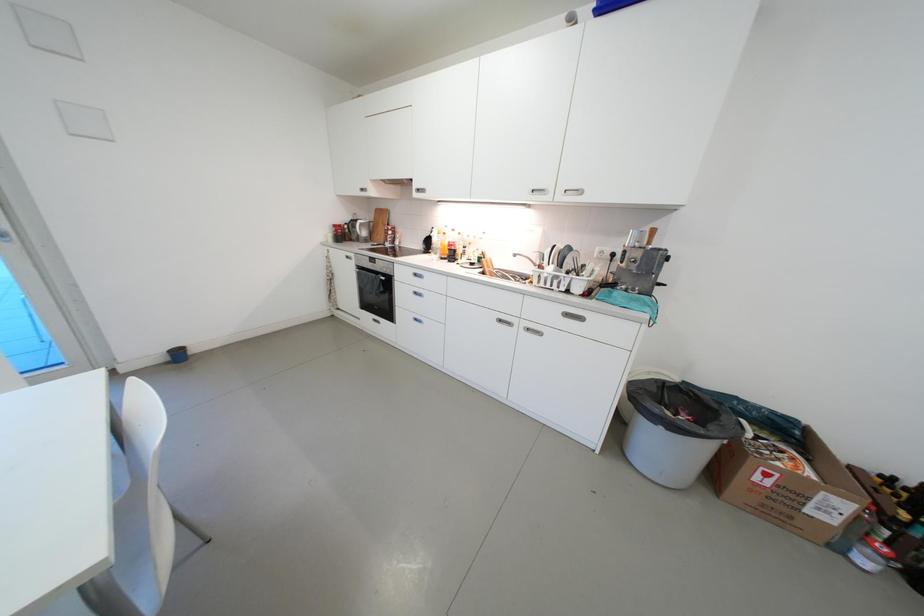
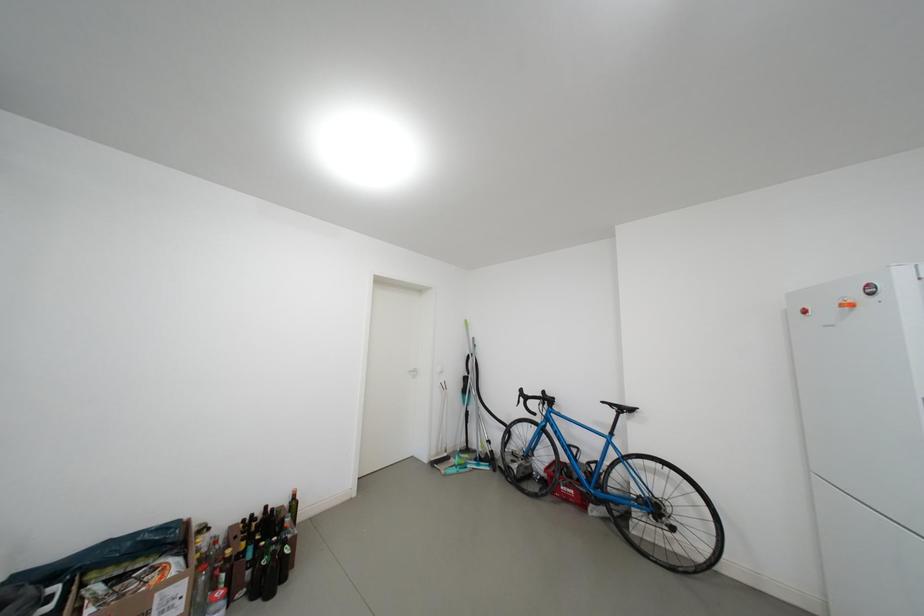
Question: The camera is either moving clockwise (left) or counter-clockwise (right) around the object. The first image is from the beginning of the video and the second image is from the end. Is the camera moving left or right when shooting the video?

Choices:
 (A) Left
 (B) Right

Answer: (A)